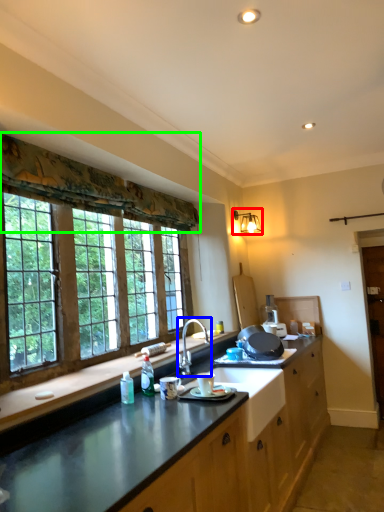
Question: Which object is the closest to the light fixture (highlighted by a red box)? Choose among these: sink (highlighted by a blue box) or curtain (highlighted by a green box).

Choices:
 (A) sink
 (B) curtain

Answer: (B)